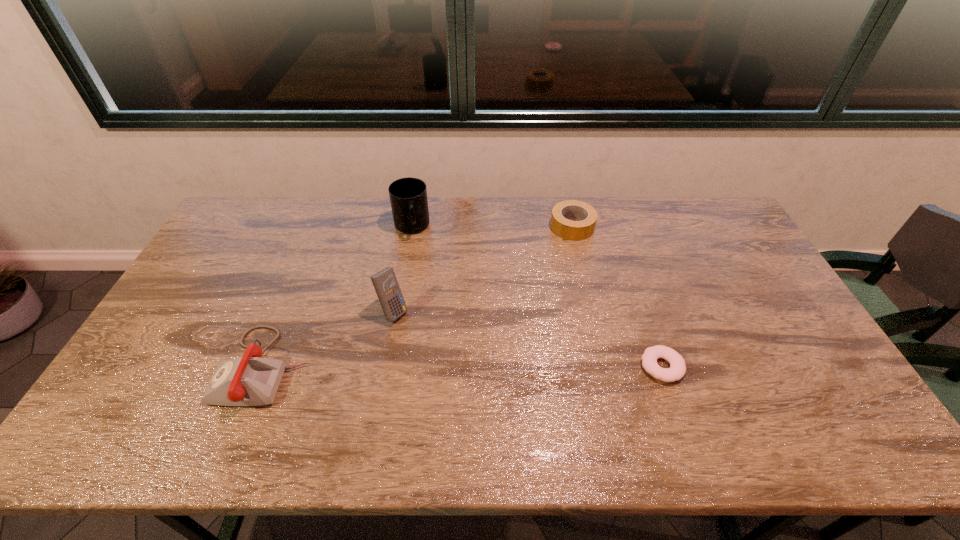
Identify the location of vacant space on the desktop that is between the third tallest object and the rightmost object and is positioned at the edge of the second shortest object. (501, 367).

Where is `vacant space on the desktop that is between the third tallest object and the shortest object and is positioned on the side of the mug with the handle`? The image size is (960, 540). vacant space on the desktop that is between the third tallest object and the shortest object and is positioned on the side of the mug with the handle is located at coordinates (x=442, y=367).

You are a GUI agent. You are given a task and a screenshot of the screen. Output one action in this format:
    pyautogui.click(x=<x>, y=<y>)
    Task: Click on the free spot on the desktop that is between the third shortest object and the shortest object and is positioned on the front-facing side of the calculator
    The width and height of the screenshot is (960, 540).
    Given the screenshot: What is the action you would take?
    pyautogui.click(x=468, y=367)